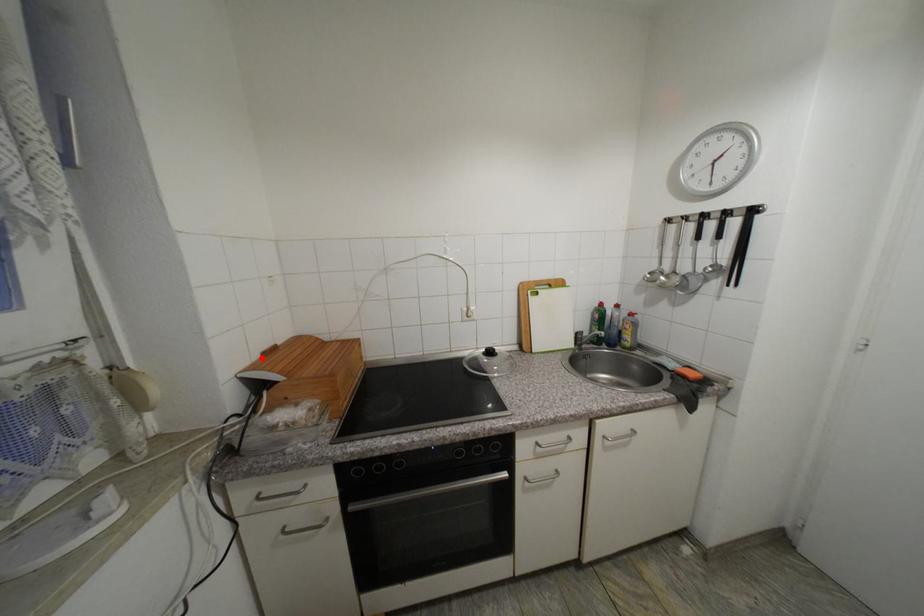
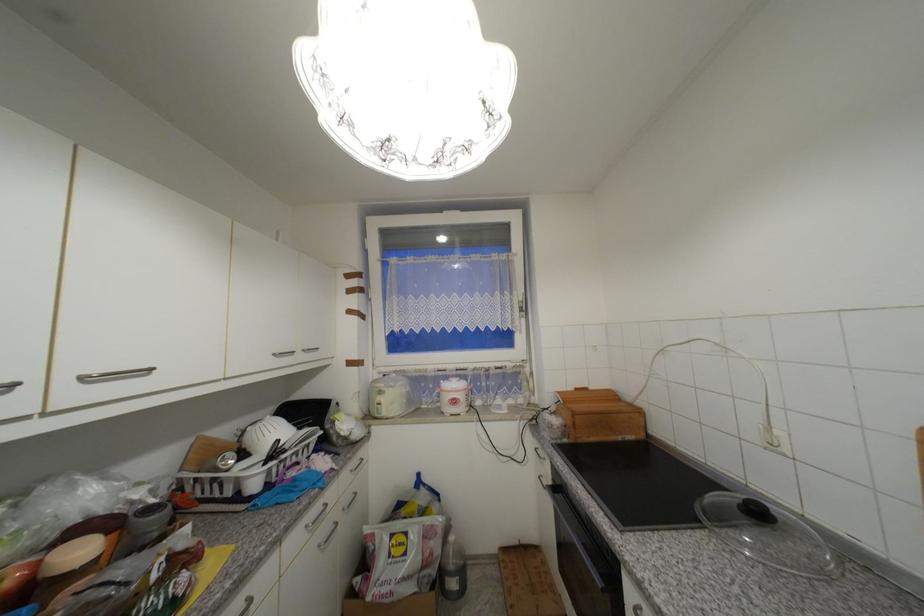
Where in the second image is the point corresponding to the highlighted location from the first image?

(576, 390)